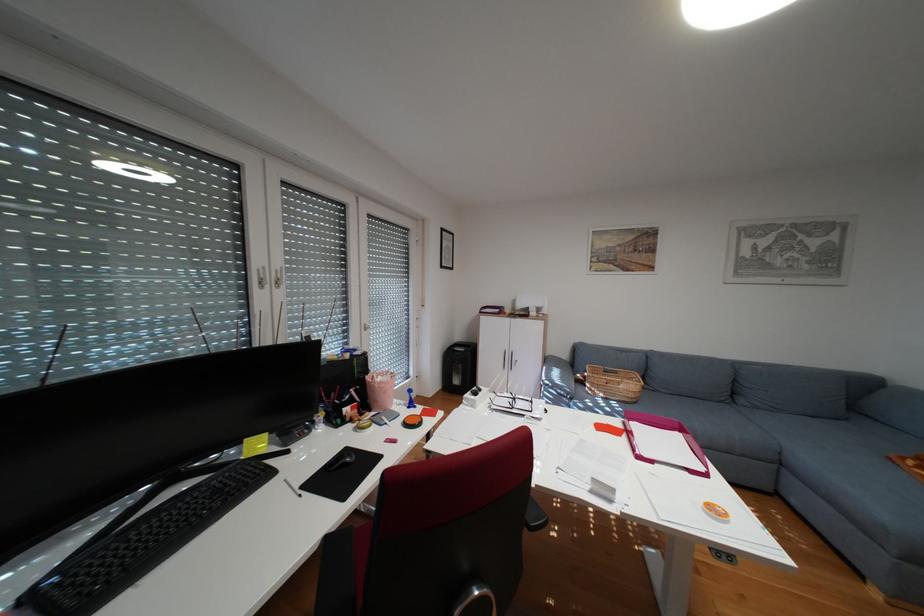
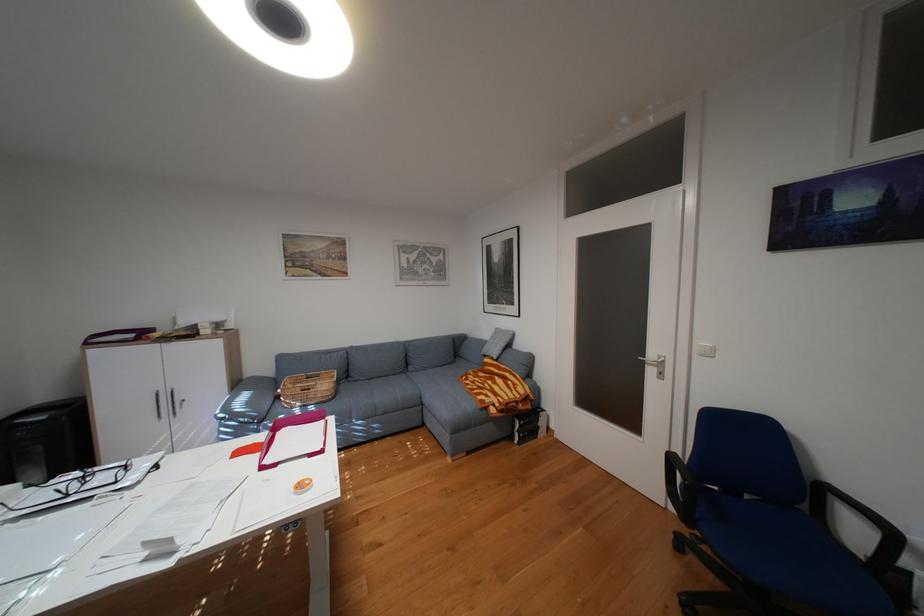
Find the pixel in the second image that matches point 768,407 in the first image.

(430, 370)